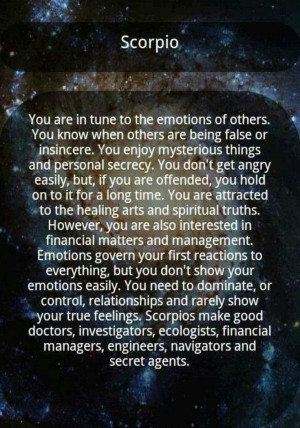
At what (x,y) coordinates should I click in order to perform the action: click on cover. Please return your answer as a coordinate pair (x, y). The height and width of the screenshot is (428, 300). Looking at the image, I should click on (285, 156).